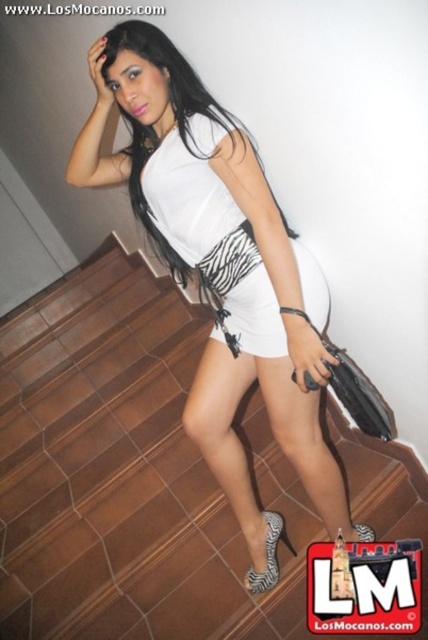
You are standing at point (226, 308) and want to move to point (238, 488). Is the destination point behind you?

Yes, point (238, 488) is behind point (226, 308), so the destination point is behind you.

Looking at this image, you are a fashion designer observing the woman in the image. You need to determine the order of the clothing items from top to bottom. Which item is higher on her body between the white matte tank top at center and the zebra print fabric sandal at lower center?

The white matte tank top at center is higher on her body than the zebra print fabric sandal at lower center, as it has a greater height compared to the sandal.